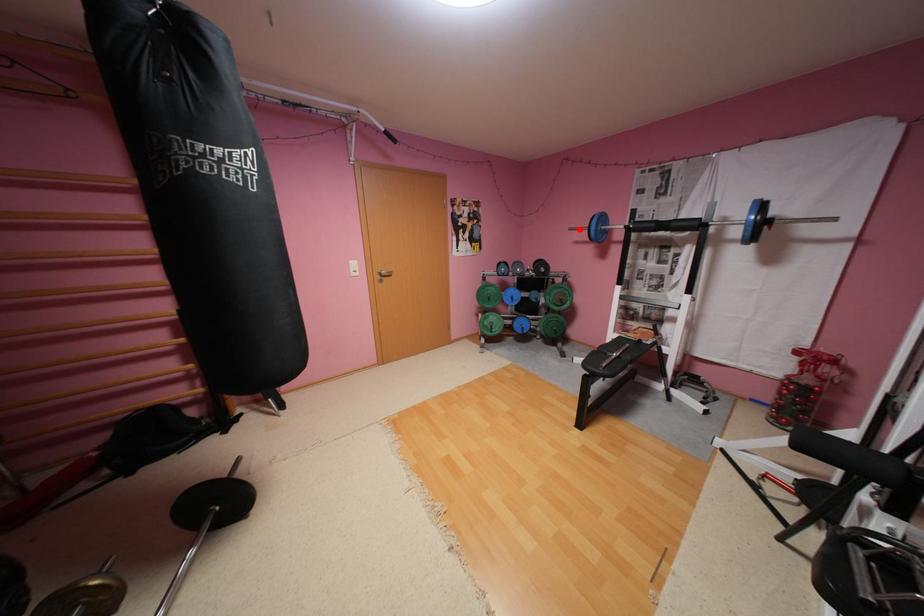
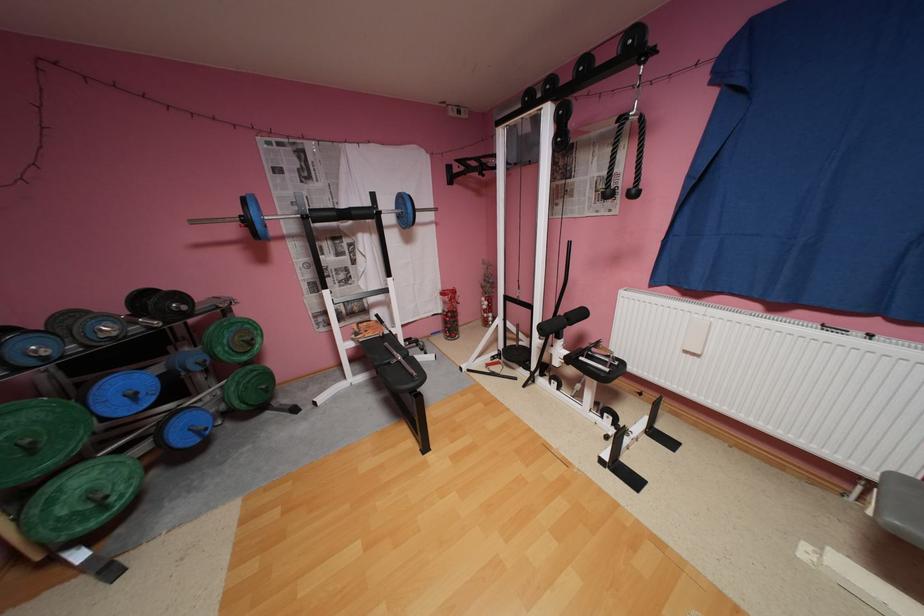
In the second image, find the point that corresponds to the highlighted location in the first image.

(202, 223)